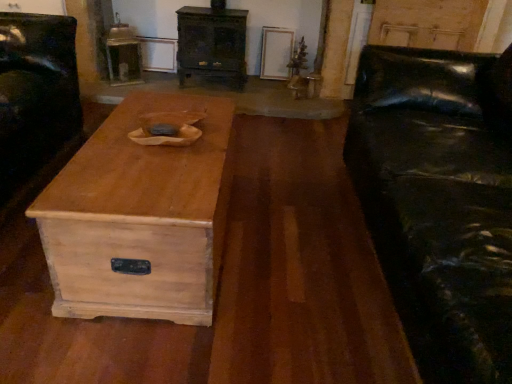
Where is `vacant space to the right of light brown wood coffee table at center`? The width and height of the screenshot is (512, 384). vacant space to the right of light brown wood coffee table at center is located at coordinates (294, 251).